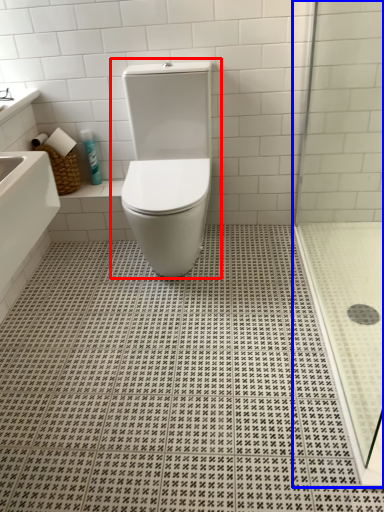
Question: Which point is further to the camera, toilet (highlighted by a red box) or shower door (highlighted by a blue box)?

Choices:
 (A) toilet
 (B) shower door

Answer: (A)